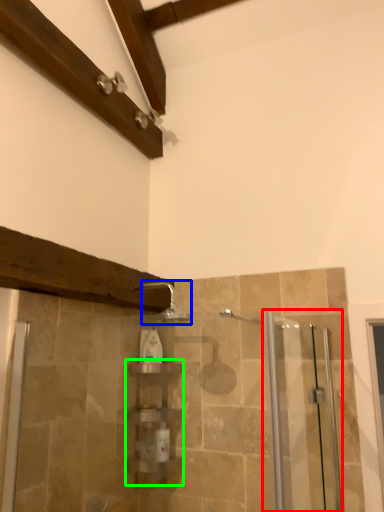
Question: Estimate the real-world distances between objects in this image. Which object is farther from screen door (highlighted by a red box), shower (highlighted by a blue box) or shelf (highlighted by a green box)?

Choices:
 (A) shower
 (B) shelf

Answer: (A)